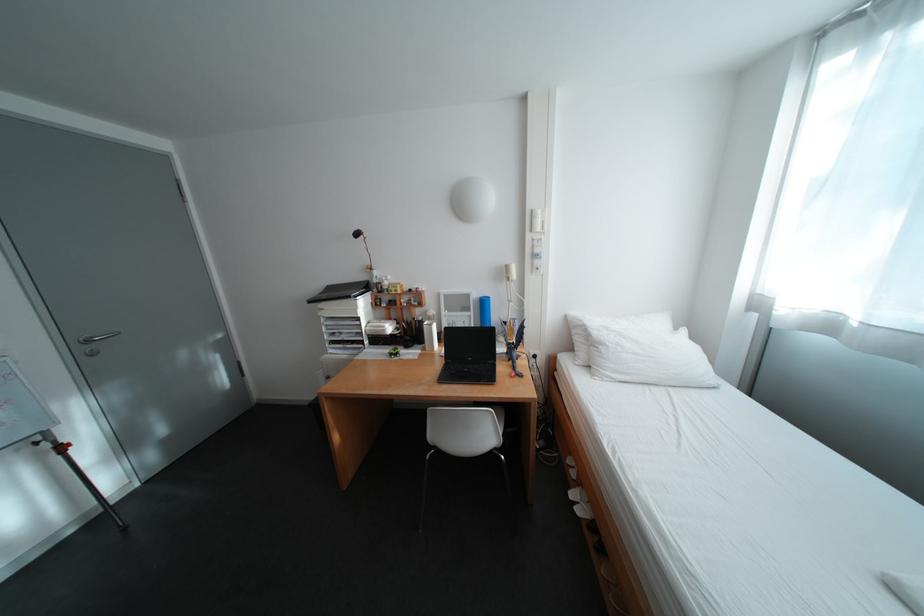
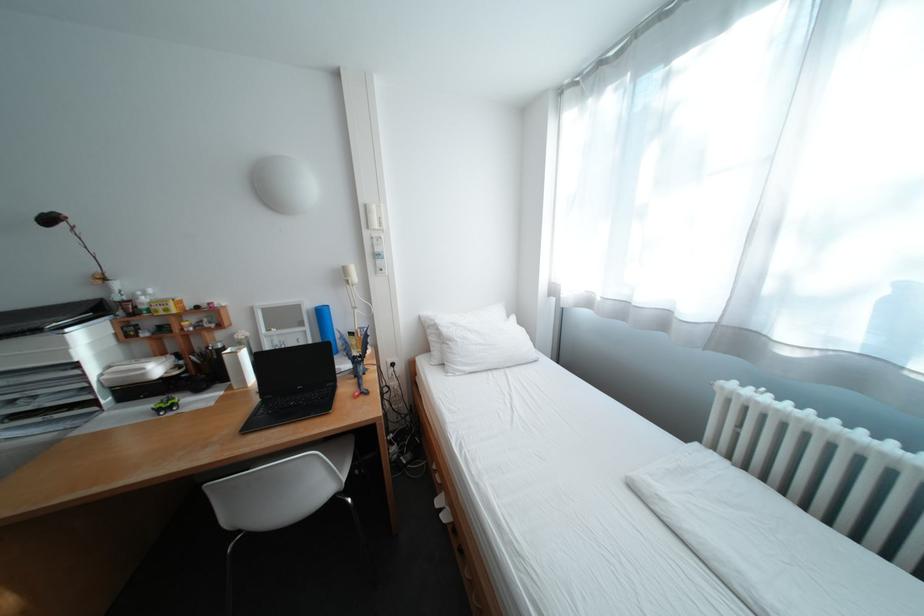
Consider the image. The images are taken continuously from a first-person perspective. In which direction are you moving?

The cameraman walked toward right, forward.